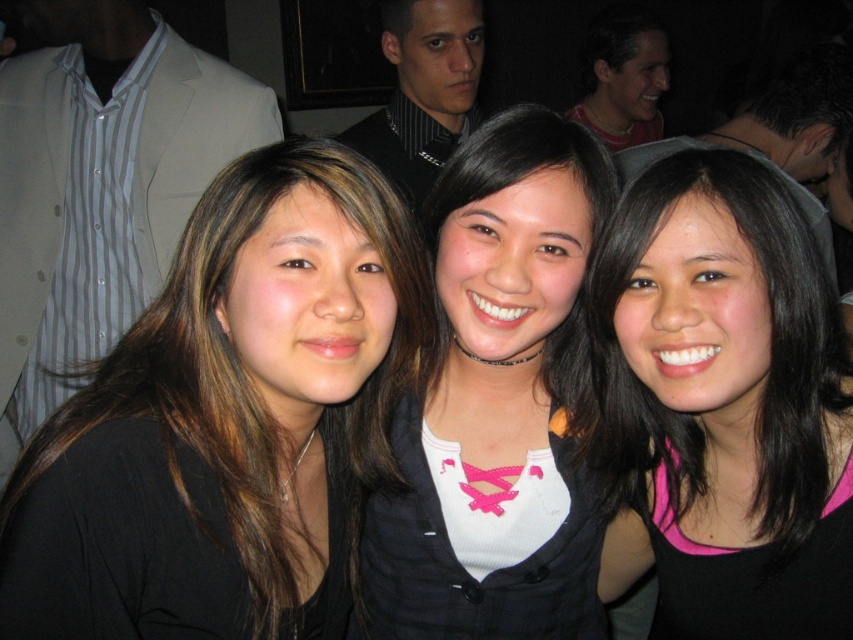
You are a photographer trying to adjust the lighting for a closeup shot of the black matte hair at left and the matte black shirt at upper center. Which object should you focus on first if you want to ensure both are well lit, considering their sizes?

The black matte hair at left is smaller than the matte black shirt at upper center, so you should focus on lighting the matte black shirt at upper center first since it is larger and might require more attention to ensure proper exposure.

You are trying to decide which top to wear for an upcoming event. You have a pink matte tank top at center and a matte black shirt at upper center. Based on the image, which top is positioned lower on the body?

The pink matte tank top at center is positioned lower than the matte black shirt at upper center because it is described as being below it.